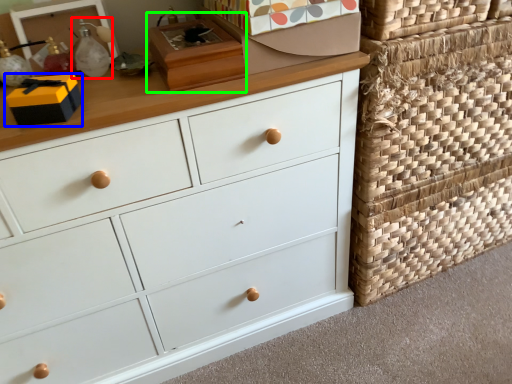
Question: Based on their relative distances, which object is farther from toy (highlighted by a red box)? Choose from storage box (highlighted by a blue box) and shoe box (highlighted by a green box).

Choices:
 (A) storage box
 (B) shoe box

Answer: (B)